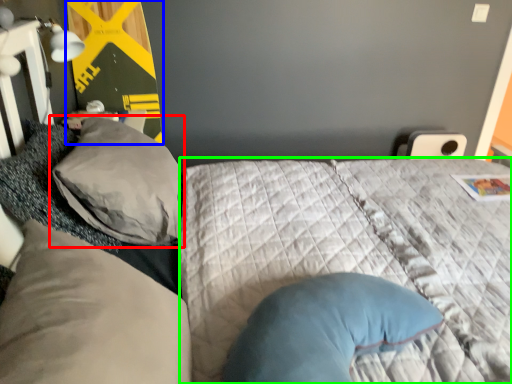
Question: Which is nearer to the pillow (highlighted by a red box)? bulletin board (highlighted by a blue box) or mattress (highlighted by a green box).

Choices:
 (A) bulletin board
 (B) mattress

Answer: (B)